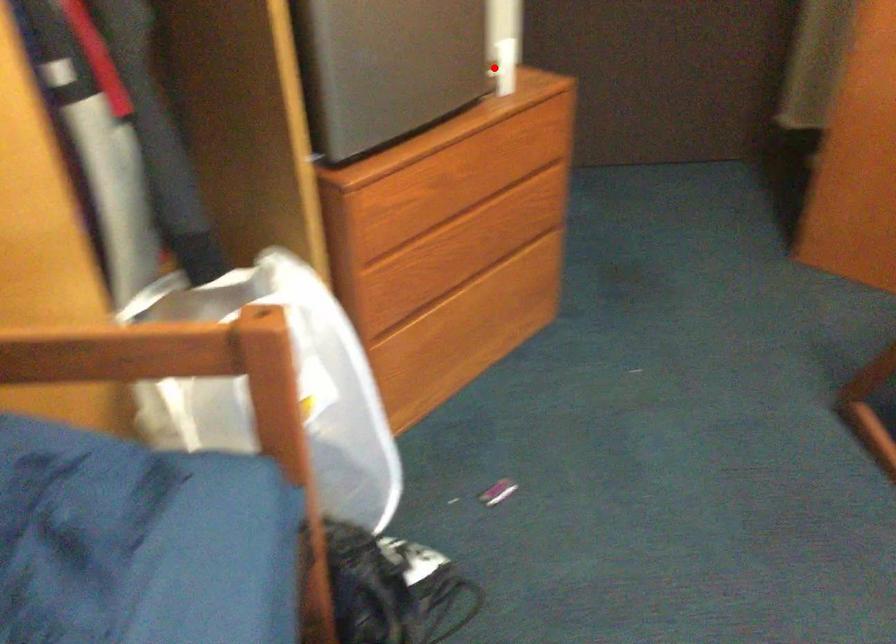
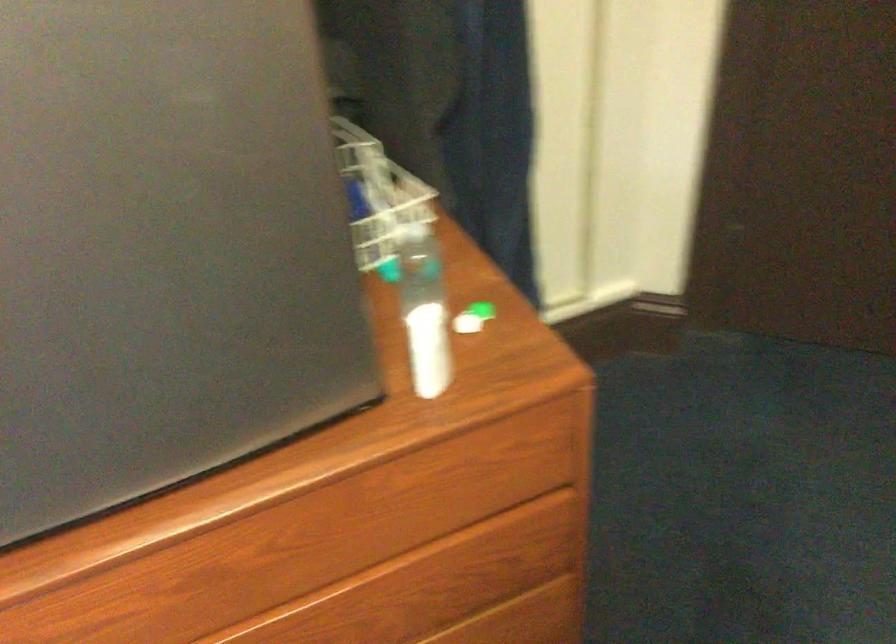
Where in the second image is the point corresponding to the highlighted location from the first image?

(480, 308)